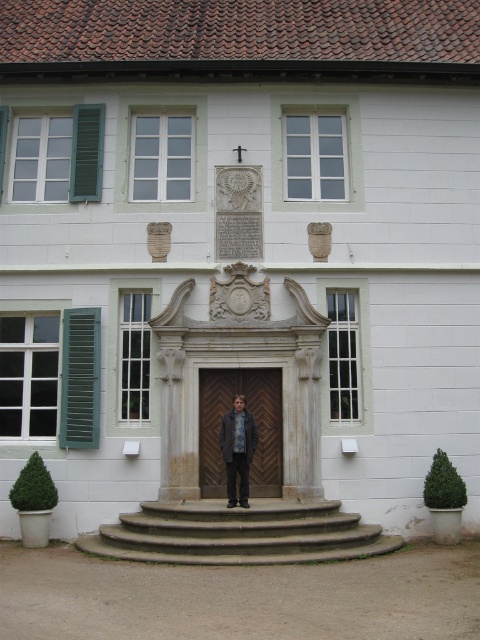
Question: Which of the following is the closest to the observer?

Choices:
 (A) (171, 561)
 (B) (236, 502)
 (C) (96, 141)
 (D) (231, 396)

Answer: (A)

Question: Can you confirm if smooth concrete stairs at center is thinner than green wood shutter at left?

Choices:
 (A) no
 (B) yes

Answer: (A)

Question: Is smooth concrete stairs at center closer to the viewer compared to denim jacket at center?

Choices:
 (A) yes
 (B) no

Answer: (A)

Question: Which object appears closest to the camera in this image?

Choices:
 (A) smooth concrete stairs at center
 (B) wooden door at center

Answer: (A)

Question: Which of the following is the closest to the observer?

Choices:
 (A) smooth concrete stairs at center
 (B) green painted wood shutter at left
 (C) wooden door at center

Answer: (A)

Question: Does smooth concrete stairs at center lie behind denim jacket at center?

Choices:
 (A) no
 (B) yes

Answer: (A)